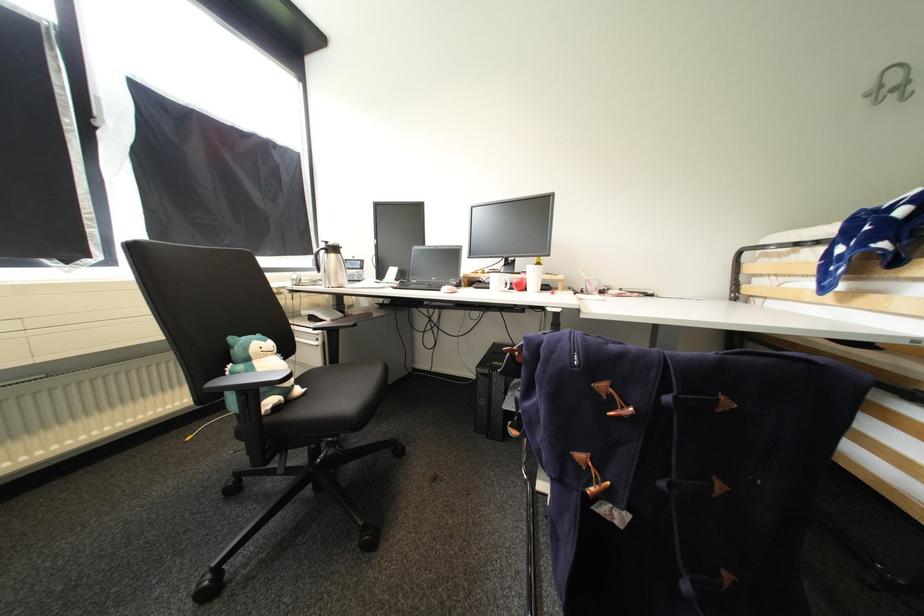
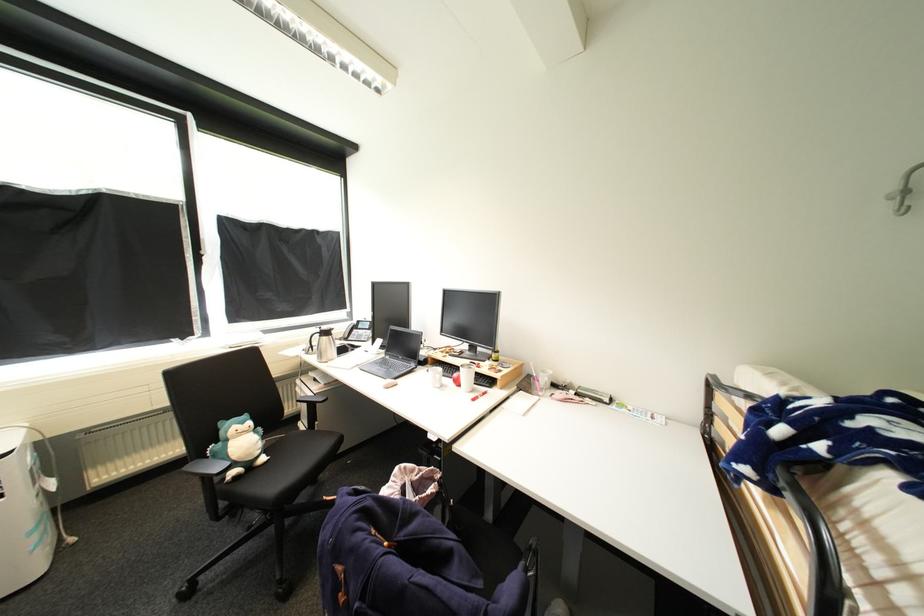
Locate, in the second image, the point that corresponds to [873,97] in the first image.

(900, 199)